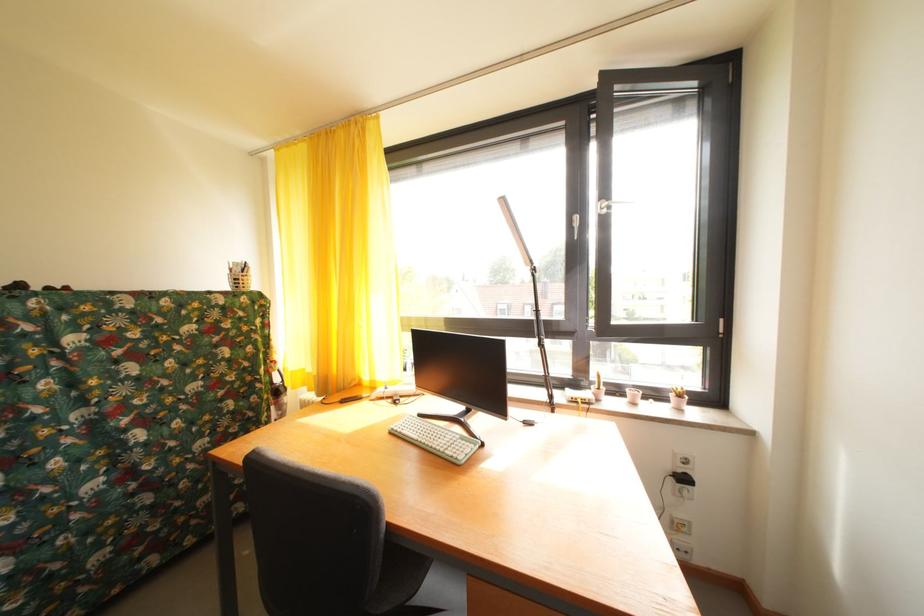
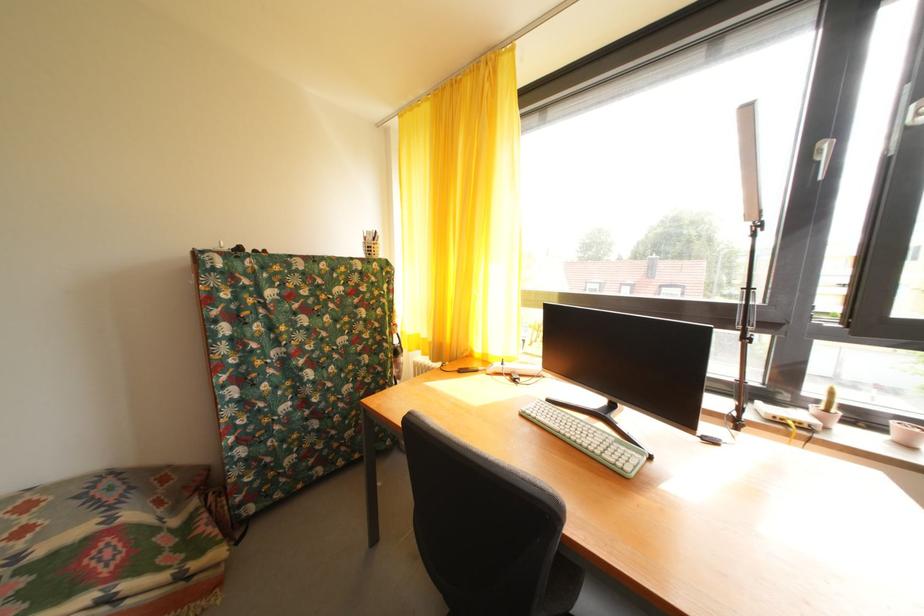
In the second image, find the point that corresponds to the point at 576,395 in the first image.

(768, 408)